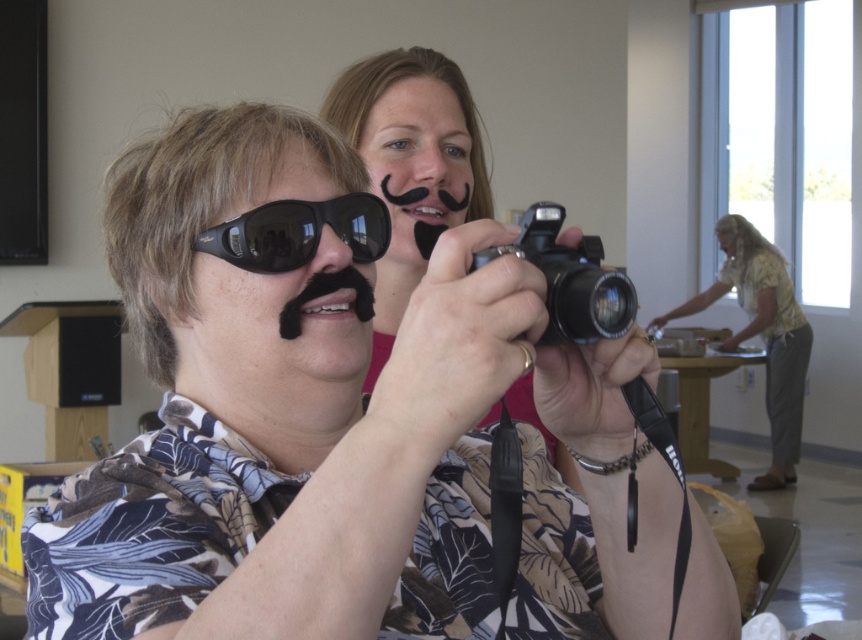
Is black plastic camera at center taller than smooth skin face at center?

In fact, black plastic camera at center may be shorter than smooth skin face at center.

Identify the location of black plastic camera at center. The height and width of the screenshot is (640, 862). (570, 280).

Which is above, black matte sunglasses at center or black plastic camera at center?

black matte sunglasses at center is above.

Is point (345, 340) in front of point (566, 323)?

No, (345, 340) is further to viewer.

Where is `black matte sunglasses at center`? The width and height of the screenshot is (862, 640). black matte sunglasses at center is located at coordinates (292, 268).

Consider the image. Is black matte camera at center positioned at the back of smooth skin face at center?

No.

Is black matte camera at center shorter than smooth skin face at center?

No, black matte camera at center is not shorter than smooth skin face at center.

Does point (403, 147) lie behind point (729, 257)?

No, it is in front of (729, 257).

Where is `black matte camera at center`? The width and height of the screenshot is (862, 640). black matte camera at center is located at coordinates (411, 163).